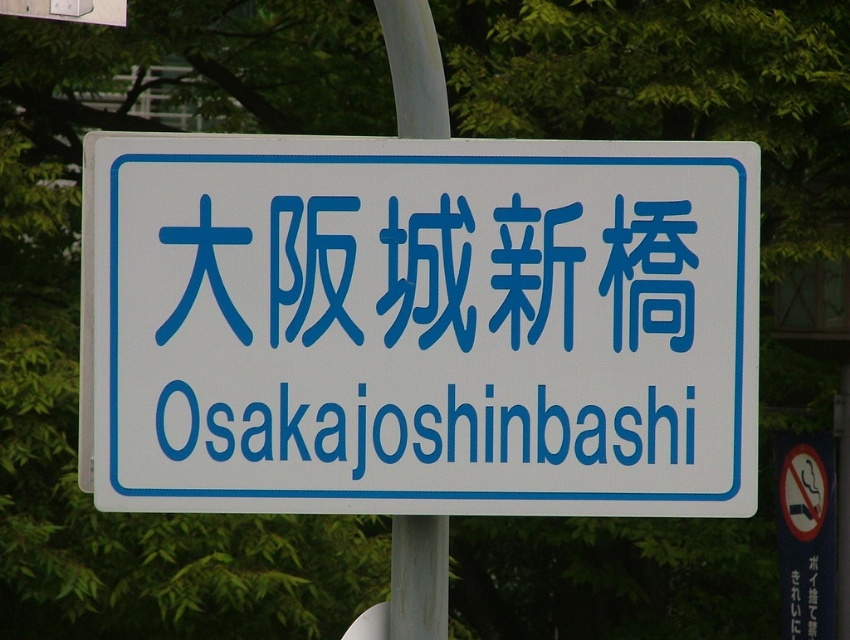
You are standing at the base of the road sign and want to walk towards the point that is closer to you. Which point should you head towards, point (191, 163) or point (443, 579)?

Point (191, 163) is in front of point (443, 579), so you should head towards point (191, 163) as it is closer to you.

You are a city planner designing a new pathway. You need to place a bench next to the metallic gray pole at center so that it doesn not block the blue plastic sign at center. Given that the pole is narrower than the sign, where should you place the bench relative to the pole to ensure the sign remains visible?

Since the metallic gray pole at center is narrower than the blue plastic sign at center, placing the bench to the side of the pole opposite the sign or behind the pole would ensure the sign remains visible without obstruction.

You are a painter standing in front of the white plastic signboard at center and the metallic gray pole at center. You want to paint both objects but need to know which one is taller. Which object is taller?

The white plastic signboard at center is taller than the metallic gray pole at center according to the description.